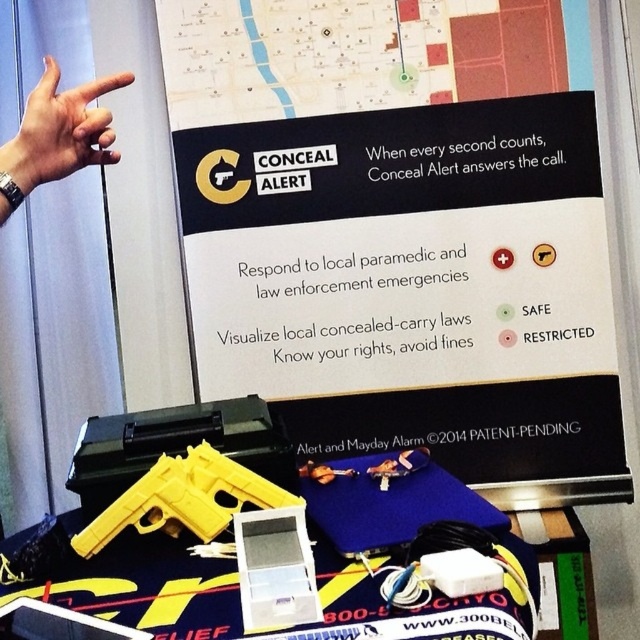
Does yellow plastic gun at lower left have a greater width compared to yellow plastic handgun at lower center?

Indeed, yellow plastic gun at lower left has a greater width compared to yellow plastic handgun at lower center.

Can you confirm if yellow plastic gun at lower left is positioned above yellow plastic handgun at lower center?

Yes.

The width and height of the screenshot is (640, 640). Identify the location of yellow plastic gun at lower left. (400, 236).

Which is in front, point (323, 448) or point (42, 160)?

Point (42, 160) is in front.

Is point (282, 17) farther from camera compared to point (99, 136)?

Yes, point (282, 17) is farther from viewer.

I want to click on yellow plastic gun at lower left, so click(400, 236).

Can you confirm if yellow plastic handgun at lower center is shorter than skinny silver watch at upper left?

Yes, yellow plastic handgun at lower center is shorter than skinny silver watch at upper left.

Is yellow plastic handgun at lower center smaller than skinny silver watch at upper left?

Yes, yellow plastic handgun at lower center is smaller than skinny silver watch at upper left.

At what (x,y) coordinates should I click in order to perform the action: click on yellow plastic handgun at lower center. Please return your answer as a coordinate pair (x, y). Image resolution: width=640 pixels, height=640 pixels. Looking at the image, I should click on (182, 499).

Identify the location of yellow plastic handgun at lower center. (182, 499).